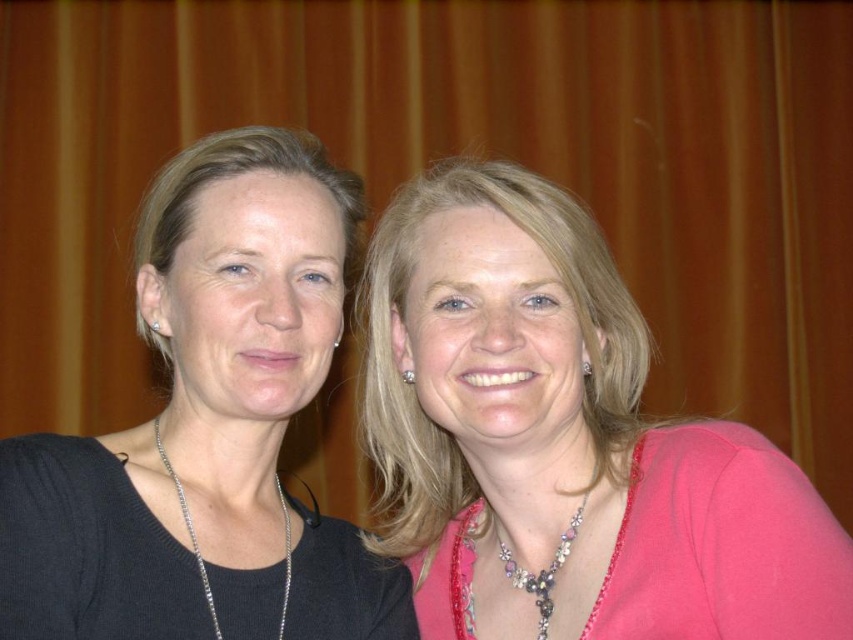
Can you confirm if black matte sweater at left is positioned below pearl and crystal necklace at center?

No.

Does black matte sweater at left appear over pearl and crystal necklace at center?

Indeed, black matte sweater at left is positioned over pearl and crystal necklace at center.

Image resolution: width=853 pixels, height=640 pixels. I want to click on black matte sweater at left, so click(207, 428).

The height and width of the screenshot is (640, 853). Find the location of `black matte sweater at left`. black matte sweater at left is located at coordinates (207, 428).

Which is more to the right, pink satin blouse at center or black matte sweater at left?

pink satin blouse at center is more to the right.

Consider the image. Is pink satin blouse at center bigger than black matte sweater at left?

Result: Indeed, pink satin blouse at center has a larger size compared to black matte sweater at left.

Is point (631, 493) farther from viewer compared to point (178, 621)?

That is True.

Where is `pink satin blouse at center`? pink satin blouse at center is located at coordinates (566, 442).

Who is taller, pink satin blouse at center or silver metallic necklace at center?

pink satin blouse at center

From the picture: Measure the distance from pink satin blouse at center to silver metallic necklace at center.

pink satin blouse at center is 11.67 inches away from silver metallic necklace at center.

Is point (372, 333) farther from viewer compared to point (285, 518)?

Yes, it is.

What are the coordinates of `pink satin blouse at center` in the screenshot? It's located at (566, 442).